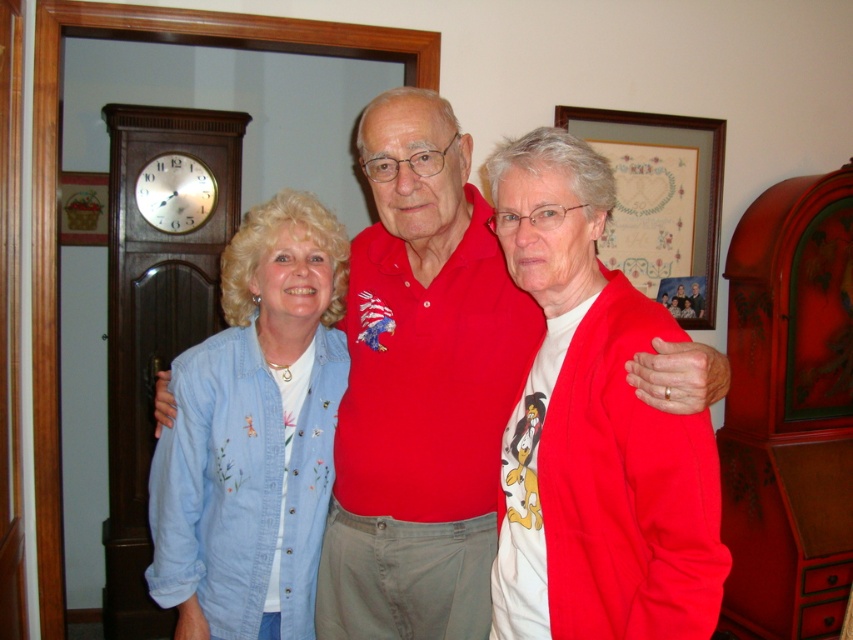
Does denim jacket at center have a smaller size compared to red cotton polo shirt at center?

Yes, denim jacket at center is smaller than red cotton polo shirt at center.

Does point (339, 557) come closer to viewer compared to point (480, 422)?

No, it is behind (480, 422).

I want to click on denim jacket at center, so pyautogui.click(x=421, y=388).

Is red cotton polo shirt at center wider than denim jacket at left?

Yes.

Image resolution: width=853 pixels, height=640 pixels. I want to click on red cotton polo shirt at center, so click(421, 388).

Find the location of a particular element. red cotton polo shirt at center is located at coordinates (421, 388).

Who is shorter, denim jacket at center or denim jacket at left?

denim jacket at left

Does denim jacket at center appear on the right side of denim jacket at left?

Indeed, denim jacket at center is positioned on the right side of denim jacket at left.

Does point (393, 308) lie in front of point (297, 538)?

No, (393, 308) is behind (297, 538).

This screenshot has height=640, width=853. What are the coordinates of `denim jacket at center` in the screenshot? It's located at (421, 388).